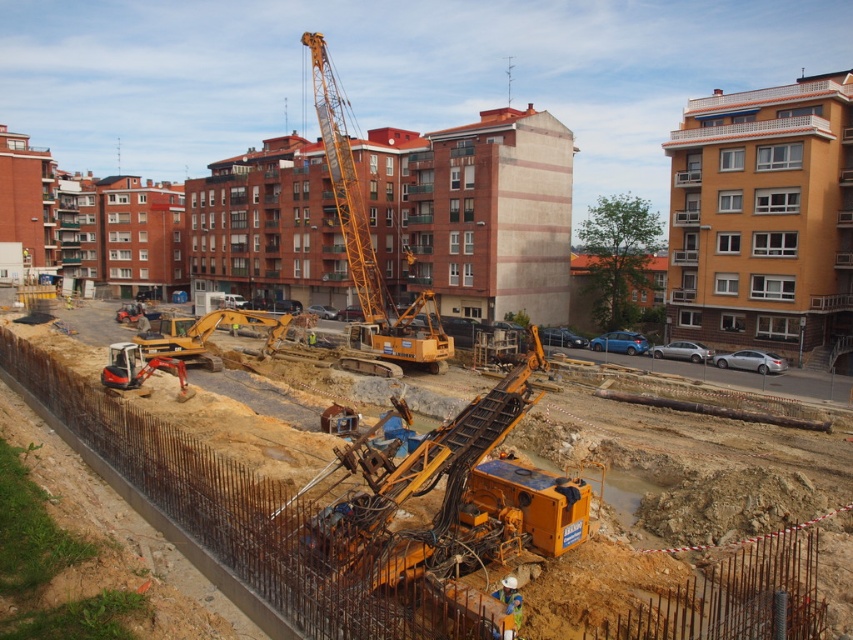
How much distance is there between yellow metallic construction equipment at center and yellow metallic crane at upper center?

19.86 meters

Between point (109, 515) and point (337, 97), which one is positioned behind?

Positioned behind is point (337, 97).

This screenshot has height=640, width=853. Describe the element at coordinates (605, 564) in the screenshot. I see `yellow metallic construction equipment at center` at that location.

This screenshot has width=853, height=640. I want to click on yellow metallic construction equipment at center, so click(605, 564).

Can you confirm if yellow metallic construction equipment at center is positioned to the left of yellow metallic drilling rig at center?

Correct, you'll find yellow metallic construction equipment at center to the left of yellow metallic drilling rig at center.

Between yellow metallic construction equipment at center and yellow metallic drilling rig at center, which one appears on the left side from the viewer's perspective?

yellow metallic construction equipment at center is more to the left.

Find the location of `yellow metallic construction equipment at center`. yellow metallic construction equipment at center is located at coordinates (605, 564).

Between yellow metallic drilling rig at center and yellow metallic crane at upper center, which one is positioned lower?

yellow metallic drilling rig at center is below.

Is point (462, 442) positioned behind point (379, 316)?

No, (462, 442) is in front of (379, 316).

The width and height of the screenshot is (853, 640). Identify the location of yellow metallic drilling rig at center. (425, 486).